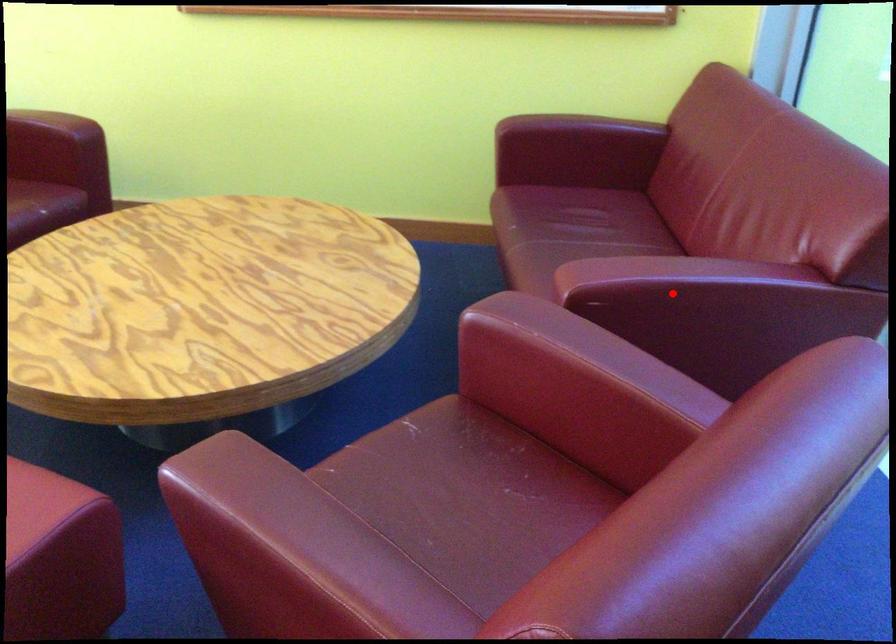
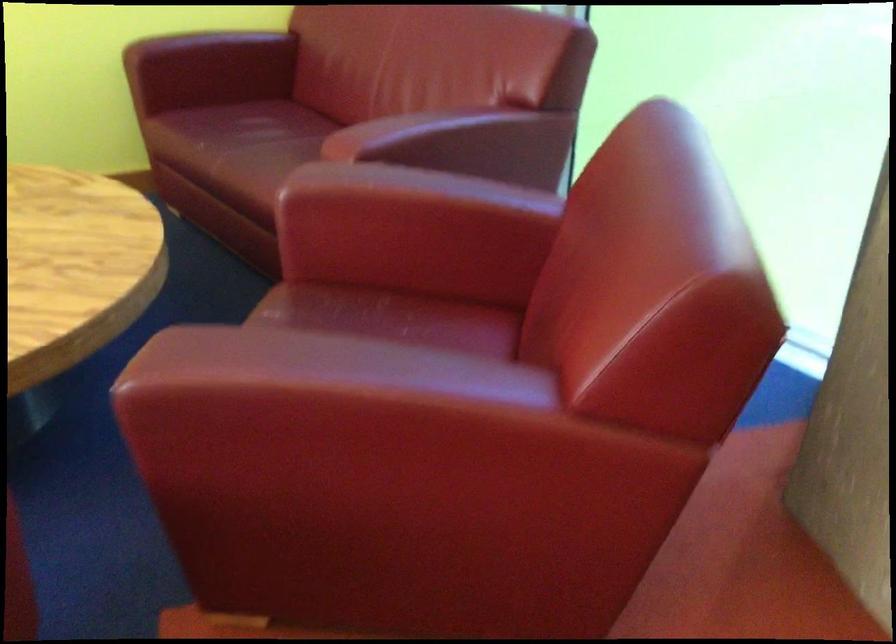
Find the pixel in the second image that matches the highlighted location in the first image.

(438, 137)